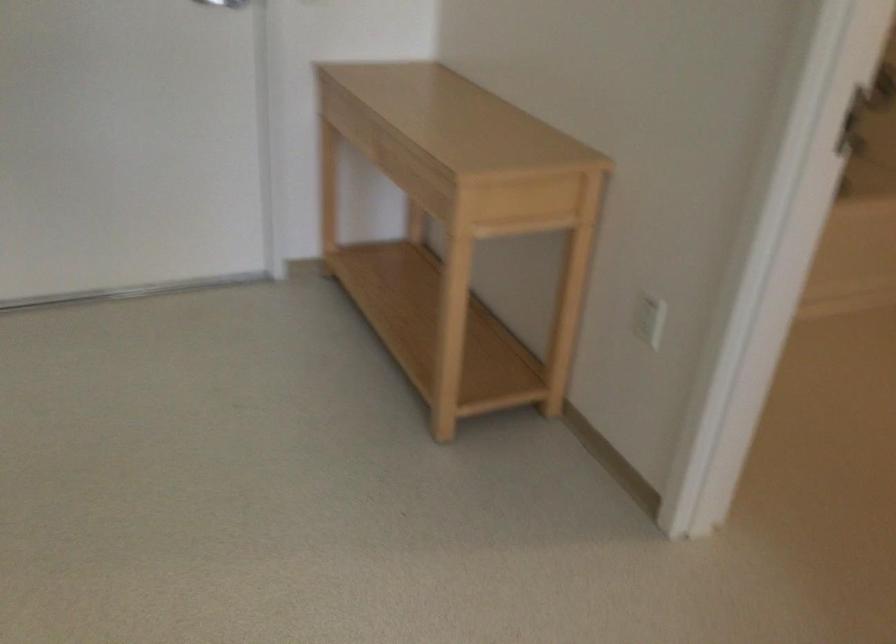
Where is `white light switch`? The height and width of the screenshot is (644, 896). white light switch is located at coordinates (648, 317).